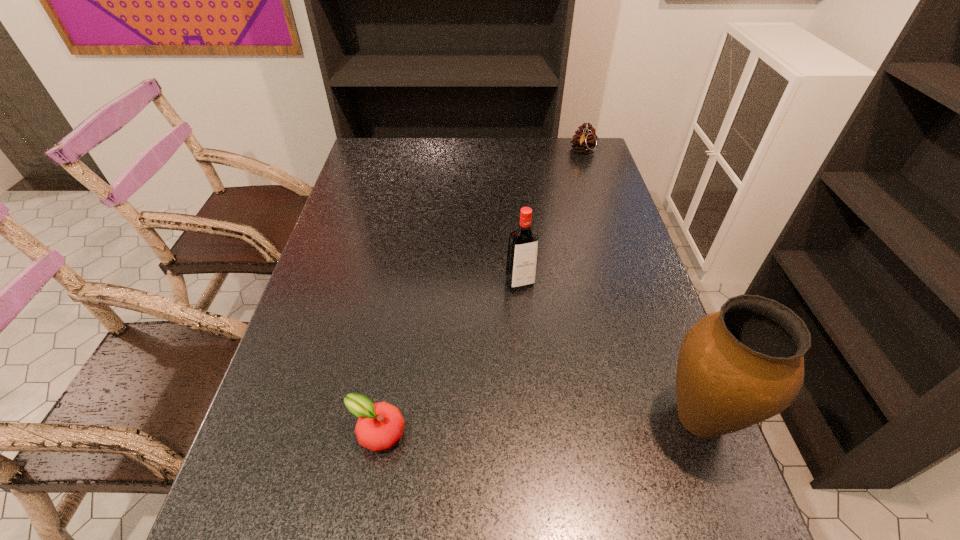
Point out which object is positioned as the nearest to the second object from left to right. Please provide its 2D coordinates. Your answer should be formatted as a tuple, i.e. [(x, y)], where the tuple contains the x and y coordinates of a point satisfying the conditions above.

[(744, 364)]

This screenshot has width=960, height=540. Find the location of `vacant area in the image that satisfies the following two spatial constraints: 1. on the back side of the pinecone; 2. on the left side of the third object from right to left`. vacant area in the image that satisfies the following two spatial constraints: 1. on the back side of the pinecone; 2. on the left side of the third object from right to left is located at coordinates (508, 151).

Locate an element on the screen. vacant area that satisfies the following two spatial constraints: 1. on the front side of the farthest object; 2. on the left side of the tallest object is located at coordinates (671, 418).

Locate an element on the screen. This screenshot has width=960, height=540. free space in the image that satisfies the following two spatial constraints: 1. on the back side of the third nearest object; 2. on the left side of the leftmost object is located at coordinates (403, 284).